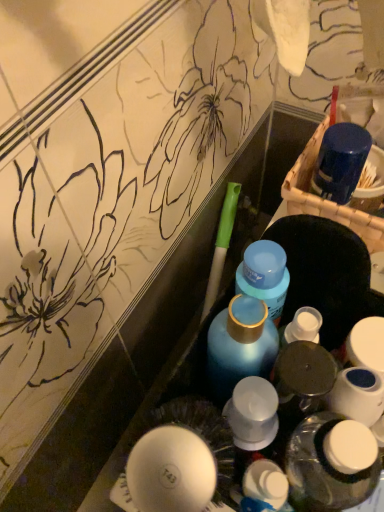
How much space does blue matte bottle at center, which is counted as the 3th bottle, starting from the bottom, occupy vertically?

It is 10.49 centimeters.

I want to click on blue matte bottle at center, which appears as the 2th bottle when ordered from the bottom, so click(x=240, y=345).

From a real-world perspective, is blue matte bottle at center, arranged as the second bottle when viewed from the top, physically located above or below blue matte bottle at center, which is counted as the 3th bottle, starting from the bottom?

In terms of real-world spatial position, blue matte bottle at center, arranged as the second bottle when viewed from the top, is above blue matte bottle at center, which is counted as the 3th bottle, starting from the bottom.

Based on the photo, relative to blue matte bottle at center, which is counted as the 3th bottle, starting from the bottom, is blue matte bottle at center, arranged as the second bottle when viewed from the top, in front or behind?

Visually, blue matte bottle at center, arranged as the second bottle when viewed from the top, is located in front of blue matte bottle at center, which is counted as the 3th bottle, starting from the bottom.

Is blue matte bottle at center, arranged as the second bottle when viewed from the top, beside blue matte bottle at center, which is the first bottle in top-to-bottom order?

Yes, blue matte bottle at center, arranged as the second bottle when viewed from the top, is beside blue matte bottle at center, which is the first bottle in top-to-bottom order.

How much distance is there between blue matte bottle at center, arranged as the second bottle when viewed from the top, and blue matte bottle at center, which is counted as the 3th bottle, starting from the bottom?

blue matte bottle at center, arranged as the second bottle when viewed from the top, and blue matte bottle at center, which is counted as the 3th bottle, starting from the bottom, are 1.48 inches apart from each other.

Is blue matte bottle at center, which is the first bottle in top-to-bottom order, turned away from white plastic bottle at center, the 1th bottle when ordered from bottom to top?

No.

Who is more distant, blue matte bottle at center, which is counted as the 3th bottle, starting from the bottom, or white plastic bottle at center, arranged as the third bottle when viewed from the top?

Positioned behind is blue matte bottle at center, which is counted as the 3th bottle, starting from the bottom.

Measure the distance from blue matte bottle at center, which is the first bottle in top-to-bottom order, to white plastic bottle at center, arranged as the third bottle when viewed from the top.

blue matte bottle at center, which is the first bottle in top-to-bottom order, and white plastic bottle at center, arranged as the third bottle when viewed from the top, are 4.72 inches apart.

Consider the image. Considering the relative sizes of blue matte bottle at center, which is counted as the 3th bottle, starting from the bottom, and white plastic bottle at center, arranged as the third bottle when viewed from the top, in the image provided, is blue matte bottle at center, which is counted as the 3th bottle, starting from the bottom, smaller than white plastic bottle at center, arranged as the third bottle when viewed from the top,?

Indeed, blue matte bottle at center, which is counted as the 3th bottle, starting from the bottom, has a smaller size compared to white plastic bottle at center, arranged as the third bottle when viewed from the top.

Is white plastic bottle at center, the 1th bottle when ordered from bottom to top, touching white plastic bottle at center?

Yes, white plastic bottle at center, the 1th bottle when ordered from bottom to top, is touching white plastic bottle at center.

Is white plastic bottle at center, arranged as the third bottle when viewed from the top, facing towards white plastic bottle at center?

No, white plastic bottle at center, arranged as the third bottle when viewed from the top, is not facing towards white plastic bottle at center.

How many degrees apart are the facing directions of white plastic bottle at center, arranged as the third bottle when viewed from the top, and white plastic bottle at center?

The facing directions of white plastic bottle at center, arranged as the third bottle when viewed from the top, and white plastic bottle at center are 0.0127 degrees apart.

From a real-world perspective, is white plastic bottle at center, arranged as the third bottle when viewed from the top, over white plastic bottle at center?

Yes, from a real-world perspective, white plastic bottle at center, arranged as the third bottle when viewed from the top, is on top of white plastic bottle at center.

From a real-world perspective, is blue matte bottle at center, which is the first bottle in top-to-bottom order, under blue matte bottle at center, arranged as the second bottle when viewed from the top?

Yes.

Is blue matte bottle at center, which is the first bottle in top-to-bottom order, touching blue matte bottle at center, arranged as the second bottle when viewed from the top?

Yes, blue matte bottle at center, which is the first bottle in top-to-bottom order, is next to blue matte bottle at center, arranged as the second bottle when viewed from the top.

Is white plastic bottle at center, arranged as the third bottle when viewed from the top, turned away from blue matte bottle at center, arranged as the second bottle when viewed from the top?

No.

In order to click on the 2nd bottle directly beneath the blue matte bottle at center, which appears as the 2th bottle when ordered from the bottom (from a real-world perspective) in this screenshot , I will do `click(331, 464)`.

Could blue matte bottle at center, which appears as the 2th bottle when ordered from the bottom, be considered to be inside white plastic bottle at center, arranged as the third bottle when viewed from the top?

Actually, blue matte bottle at center, which appears as the 2th bottle when ordered from the bottom, is outside white plastic bottle at center, arranged as the third bottle when viewed from the top.

How different are the orientations of blue matte bottle at center, which is counted as the 3th bottle, starting from the bottom, and white plastic bottle at center in degrees?

0.0113 degrees separate the facing orientations of blue matte bottle at center, which is counted as the 3th bottle, starting from the bottom, and white plastic bottle at center.

Is blue matte bottle at center, which is counted as the 3th bottle, starting from the bottom, taller than white plastic bottle at center?

Indeed, blue matte bottle at center, which is counted as the 3th bottle, starting from the bottom, has a greater height compared to white plastic bottle at center.

Is blue matte bottle at center, which is counted as the 3th bottle, starting from the bottom, located outside white plastic bottle at center?

blue matte bottle at center, which is counted as the 3th bottle, starting from the bottom, lies outside white plastic bottle at center's area.

Is blue matte bottle at center, which is the first bottle in top-to-bottom order, facing towards white plastic bottle at center?

A: No, blue matte bottle at center, which is the first bottle in top-to-bottom order, is not turned towards white plastic bottle at center.

Is point (265, 324) closer to camera compared to point (256, 485)?

No, (265, 324) is further to viewer.

Considering the relative positions of blue matte bottle at center, which appears as the 2th bottle when ordered from the bottom, and white plastic bottle at center in the image provided, is blue matte bottle at center, which appears as the 2th bottle when ordered from the bottom, behind white plastic bottle at center?

Yes.

From a real-world perspective, is blue matte bottle at center, arranged as the second bottle when viewed from the top, positioned under white plastic bottle at center based on gravity?

No, from a real-world perspective, blue matte bottle at center, arranged as the second bottle when viewed from the top, is not below white plastic bottle at center.

The height and width of the screenshot is (512, 384). In order to click on the 2nd bottle above the white plastic bottle at center (from the image's perspective) in this screenshot , I will do `click(240, 345)`.

From the image's perspective, starting from the blue matte bottle at center, which is counted as the 3th bottle, starting from the bottom, which bottle is the 1st one below? Please provide its 2D coordinates.

[(240, 345)]

Where is `bottle below the blue matte bottle at center, which is counted as the 3th bottle, starting from the bottom (from a real-world perspective)`? bottle below the blue matte bottle at center, which is counted as the 3th bottle, starting from the bottom (from a real-world perspective) is located at coordinates (331, 464).

Which object lies further to the anchor point white plastic bottle at center, the 1th bottle when ordered from bottom to top, white plastic bottle at center or blue matte bottle at center, which is the first bottle in top-to-bottom order?

blue matte bottle at center, which is the first bottle in top-to-bottom order.

Which object lies further to the anchor point blue matte bottle at center, which is counted as the 3th bottle, starting from the bottom, blue matte bottle at center, which appears as the 2th bottle when ordered from the bottom, or white plastic bottle at center?

white plastic bottle at center is further to blue matte bottle at center, which is counted as the 3th bottle, starting from the bottom.

From the image, which object appears to be farther from white plastic bottle at center, blue matte bottle at center, which is counted as the 3th bottle, starting from the bottom, or white plastic bottle at center, the 1th bottle when ordered from bottom to top?

blue matte bottle at center, which is counted as the 3th bottle, starting from the bottom, lies further to white plastic bottle at center than the other object.

Estimate the real-world distances between objects in this image. Which object is closer to white plastic bottle at center, white plastic bottle at center, the 1th bottle when ordered from bottom to top, or blue matte bottle at center, which appears as the 2th bottle when ordered from the bottom?

white plastic bottle at center, the 1th bottle when ordered from bottom to top.

From the image, which object appears to be farther from blue matte bottle at center, which appears as the 2th bottle when ordered from the bottom, white plastic bottle at center, the 1th bottle when ordered from bottom to top, or white plastic bottle at center?

white plastic bottle at center is positioned further to the anchor blue matte bottle at center, which appears as the 2th bottle when ordered from the bottom.

Looking at the image, which one is located further to blue matte bottle at center, which appears as the 2th bottle when ordered from the bottom, white plastic bottle at center or white plastic bottle at center, arranged as the third bottle when viewed from the top?

white plastic bottle at center is further to blue matte bottle at center, which appears as the 2th bottle when ordered from the bottom.

Looking at the image, which one is located further to blue matte bottle at center, which is counted as the 3th bottle, starting from the bottom, white plastic bottle at center, arranged as the third bottle when viewed from the top, or white plastic bottle at center?

The object further to blue matte bottle at center, which is counted as the 3th bottle, starting from the bottom, is white plastic bottle at center.

Based on their spatial positions, is blue matte bottle at center, which is the first bottle in top-to-bottom order, or white plastic bottle at center closer to blue matte bottle at center, which appears as the 2th bottle when ordered from the bottom?

blue matte bottle at center, which is the first bottle in top-to-bottom order, is closer to blue matte bottle at center, which appears as the 2th bottle when ordered from the bottom.

This screenshot has height=512, width=384. What are the coordinates of `bottle between blue matte bottle at center, arranged as the second bottle when viewed from the top, and white plastic bottle at center vertically` in the screenshot? It's located at (331, 464).

Where is `bottle that lies between blue matte bottle at center, which is the first bottle in top-to-bottom order, and white plastic bottle at center, arranged as the third bottle when viewed from the top, from top to bottom`? The height and width of the screenshot is (512, 384). bottle that lies between blue matte bottle at center, which is the first bottle in top-to-bottom order, and white plastic bottle at center, arranged as the third bottle when viewed from the top, from top to bottom is located at coordinates (240, 345).